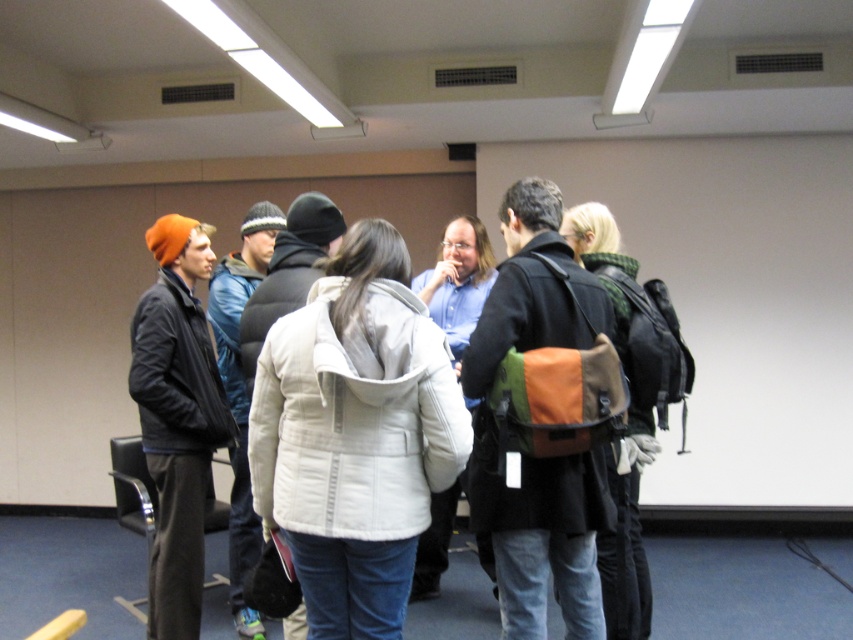
Question: Which object is the closest to the matte black jacket at left?

Choices:
 (A) orange fabric backpack at center
 (B) blue shirt at center
 (C) white puffy jacket at center

Answer: (C)

Question: Considering the relative positions of white puffy jacket at center and orange fabric backpack at center in the image provided, where is white puffy jacket at center located with respect to orange fabric backpack at center?

Choices:
 (A) left
 (B) right

Answer: (A)

Question: Does white puffy jacket at center have a greater width compared to blue shirt at center?

Choices:
 (A) no
 (B) yes

Answer: (B)

Question: Can you confirm if white puffy jacket at center is wider than matte black jacket at left?

Choices:
 (A) yes
 (B) no

Answer: (A)

Question: Which object appears farthest from the camera in this image?

Choices:
 (A) white puffy jacket at center
 (B) blue shirt at center
 (C) orange fabric backpack at center

Answer: (B)

Question: Which is nearer to the white puffy jacket at center?

Choices:
 (A) orange fabric backpack at center
 (B) blue shirt at center
 (C) matte black jacket at left

Answer: (A)